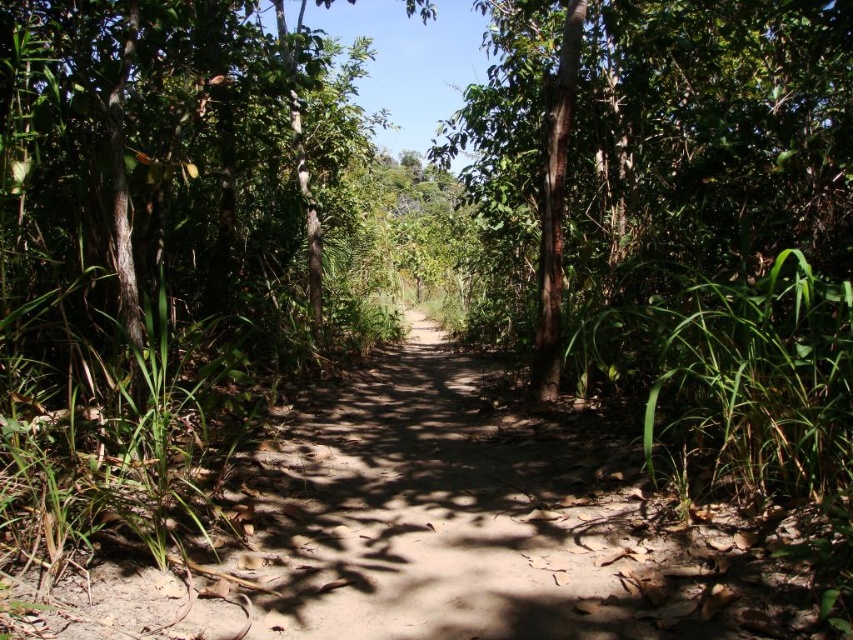
You are standing at the start of the sunlit pathway in the tropical forest. There is a point marked at coordinates (x=181, y=179). What object in the scene corresponds to this point?

The point at coordinates (x=181, y=179) corresponds to the green leafy tree at center.

You are standing at the start of a path in a tropical forest. You see a point marked at coordinates [445,532]. What is the surface type of the point?

The point is on brown sandy dirt track at center.

You are a hiker carrying a 30 cm wide backpack. You come across the brown sandy dirt track at center and the green rough bark tree at center. Which one is wider?

The brown sandy dirt track at center has a lesser width compared to green rough bark tree at center, so the green rough bark tree at center is wider.